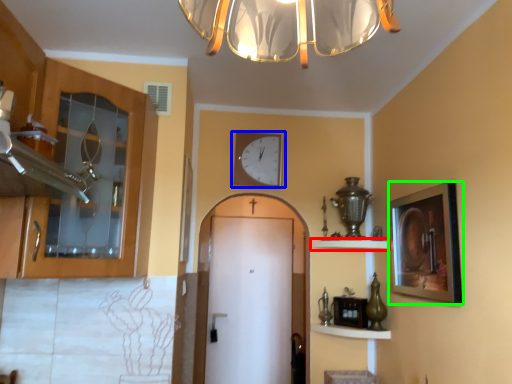
Question: Which is farther away from shelf (highlighted by a red box)? wall clock (highlighted by a blue box) or picture frame (highlighted by a green box)?

Choices:
 (A) wall clock
 (B) picture frame

Answer: (A)